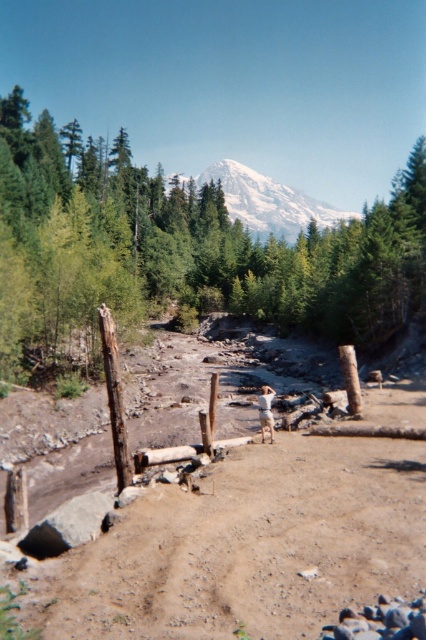
You are standing at the point marked as point (x=186, y=246) in the image. Looking around, you see the snowcapped mountain in the background and the dry riverbed. What is directly beneath your feet?

The point (x=186, y=246) is on green leafy tree at center, so the ground beneath your feet would be the dry riverbed with sandy and rocky terrain.

You are planning to build a small garden in the brown sandy dirt field at center. Considering the snowy white mountain at center is nearby, which of the two areas has more space available for planting?

The snowy white mountain at center is wider than the brown sandy dirt field at center, so the snowy white mountain at center has more space available for planting.

You are a hiker planning to take a photo of the snowy white mountain at center and the green leafy tree at center. Which object should you position closer to the left side of your camera frame to include both in the photo?

You should position the green leafy tree at center closer to the left side of your camera frame because it is already to the left of the snowy white mountain at center in the scene.